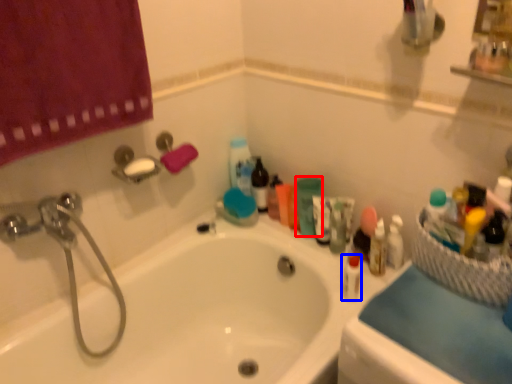
Question: Which object is further to the camera taking this photo, toiletry (highlighted by a red box) or mouthwash (highlighted by a blue box)?

Choices:
 (A) toiletry
 (B) mouthwash

Answer: (A)